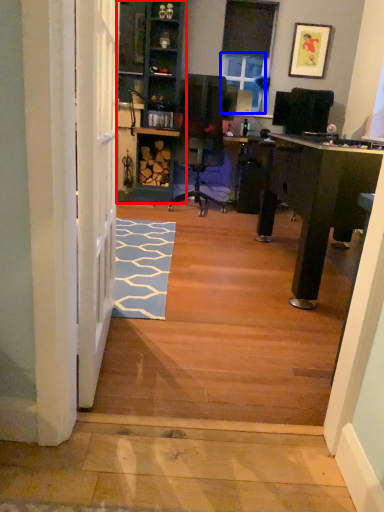
Question: Which object is closer to the camera taking this photo, bookshelf (highlighted by a red box) or window screen (highlighted by a blue box)?

Choices:
 (A) bookshelf
 (B) window screen

Answer: (A)